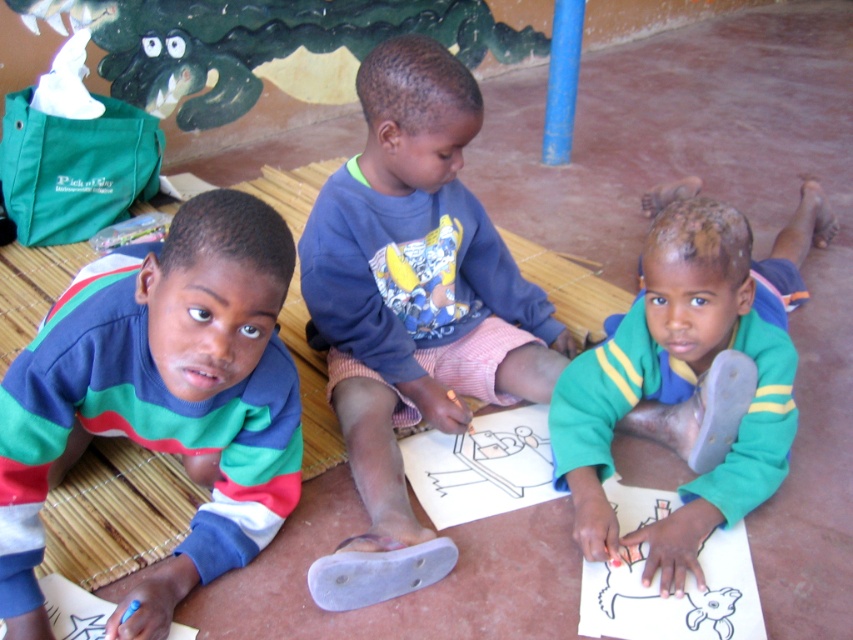
Does multicolored striped sweater at left appear on the right side of green fleece jacket at lower right?

No, multicolored striped sweater at left is not to the right of green fleece jacket at lower right.

Is multicolored striped sweater at left above green fleece jacket at lower right?

Actually, multicolored striped sweater at left is below green fleece jacket at lower right.

Identify the location of multicolored striped sweater at left. (160, 397).

Is blue cotton shirt at center below green fleece jacket at lower right?

Correct, blue cotton shirt at center is located below green fleece jacket at lower right.

Does blue cotton shirt at center have a greater width compared to green fleece jacket at lower right?

No.

Is point (398, 333) farther from camera compared to point (660, 284)?

Yes, it is behind point (660, 284).

In order to click on blue cotton shirt at center in this screenshot , I will do `click(412, 308)`.

Who is shorter, multicolored striped sweater at left or blue cotton shirt at center?

Standing shorter between the two is multicolored striped sweater at left.

Is multicolored striped sweater at left above blue cotton shirt at center?

No.

Is point (202, 381) positioned after point (427, 186)?

No.

Where is `multicolored striped sweater at left`? This screenshot has height=640, width=853. multicolored striped sweater at left is located at coordinates 160,397.